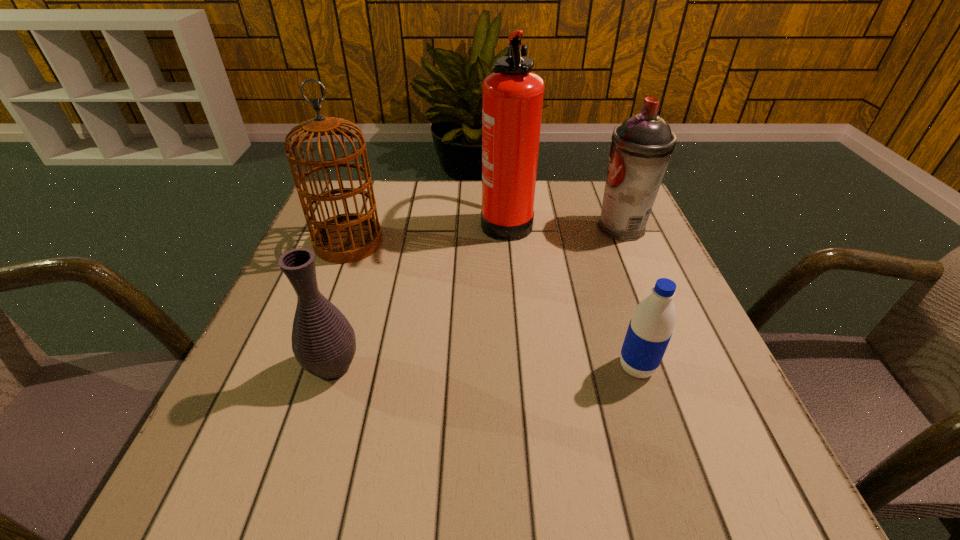
This screenshot has width=960, height=540. What are the coordinates of `vacant space located on the left of the third shortest object` in the screenshot? It's located at (449, 227).

The height and width of the screenshot is (540, 960). In order to click on vacant region located on the back of the second shortest object in this screenshot , I will do tap(359, 284).

Locate an element on the screen. The height and width of the screenshot is (540, 960). free region located on the back of the water bottle is located at coordinates (591, 228).

You are a GUI agent. You are given a task and a screenshot of the screen. Output one action in this format:
    pyautogui.click(x=<x>, y=<y>)
    Task: Click on the fire extinguisher located at the far edge
    Image resolution: width=960 pixels, height=540 pixels.
    Given the screenshot: What is the action you would take?
    pyautogui.click(x=512, y=96)

At what (x,y) coordinates should I click in order to perform the action: click on birdcage that is positioned at the far edge. Please return your answer as a coordinate pair (x, y). The height and width of the screenshot is (540, 960). Looking at the image, I should click on (345, 238).

Find the location of a particular element. The image size is (960, 540). aerosol can that is at the far edge is located at coordinates (641, 147).

I want to click on birdcage located in the left edge section of the desktop, so click(345, 238).

Where is `vase present at the left edge`? The width and height of the screenshot is (960, 540). vase present at the left edge is located at coordinates (323, 341).

Locate an element on the screen. This screenshot has height=540, width=960. aerosol can positioned at the right edge is located at coordinates (641, 147).

Identify the location of water bottle at the right edge. The height and width of the screenshot is (540, 960). (650, 329).